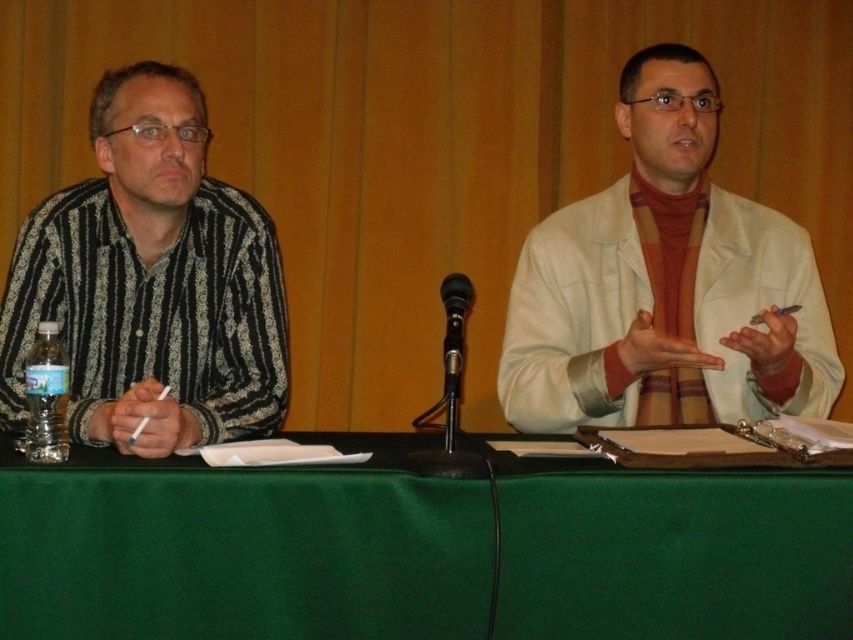
You are sitting at the table and want to pass a document to the person wearing the black striped shirt at left. Since the green fabric table at center is in the way, can you slide the document across the table to reach them?

The green fabric table at center is closer to the viewer than the black striped shirt at left, so sliding the document across the table would not reach them because the table is between you and the person.

You are a photographer setting up for a group photo. You need to position the light beige lab coat at right and the black metallic microphone at center so that the microphone is visible in the final shot. Based on their current positions, is the microphone currently obstructed by the lab coat?

The light beige lab coat at right is located above the black metallic microphone at center, so the microphone is partially or fully obstructed by the lab coat and may not be visible in the current setup.

You are a photographer setting up for a group photo. You need to ensure that the light beige lab coat at right and the black metallic microphone at center are both visible in the frame. Based on their heights, which object should you adjust the camera angle to focus on first to ensure both are in focus?

The light beige lab coat at right is taller than the black metallic microphone at center, so you should focus on the light beige lab coat at right first to ensure both are in focus.